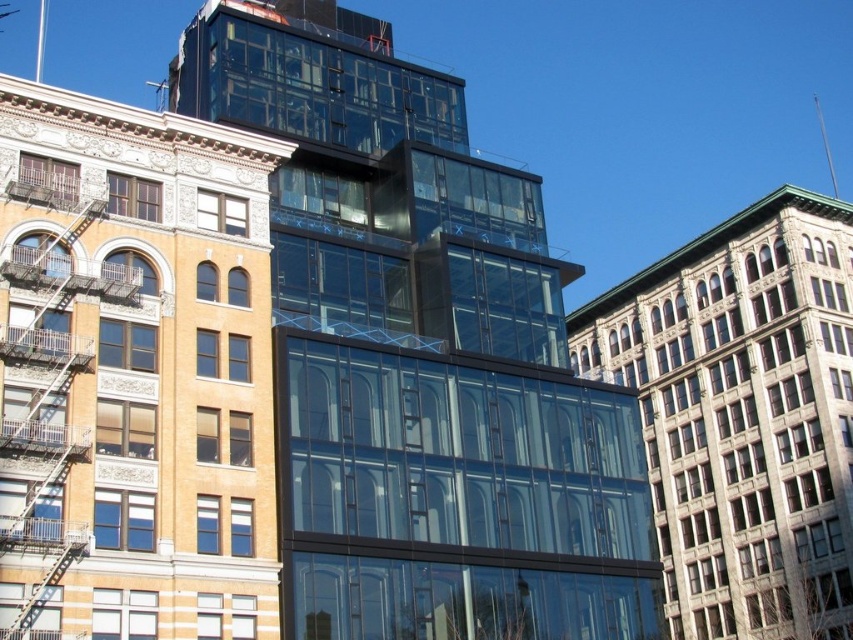
Can you confirm if clear glass building at center is positioned above gray stone building at right?

Correct, clear glass building at center is located above gray stone building at right.

Consider the image. Which is more to the right, clear glass building at center or gray stone building at right?

Positioned to the right is gray stone building at right.

Locate an element on the screen. clear glass building at center is located at coordinates (132, 372).

This screenshot has width=853, height=640. Find the location of `clear glass building at center`. clear glass building at center is located at coordinates (132, 372).

Is transparent glass building at center positioned at the back of metallic silver fire escape at left?

Yes.

Consider the image. Is transparent glass building at center to the left of metallic silver fire escape at left from the viewer's perspective?

In fact, transparent glass building at center is to the right of metallic silver fire escape at left.

This screenshot has width=853, height=640. In order to click on transparent glass building at center in this screenshot , I will do `click(421, 355)`.

Locate an element on the screen. This screenshot has height=640, width=853. transparent glass building at center is located at coordinates (421, 355).

Does transparent glass building at center appear under gray stone building at right?

No.

What do you see at coordinates (421, 355) in the screenshot?
I see `transparent glass building at center` at bounding box center [421, 355].

This screenshot has width=853, height=640. What do you see at coordinates (421, 355) in the screenshot?
I see `transparent glass building at center` at bounding box center [421, 355].

I want to click on transparent glass building at center, so click(421, 355).